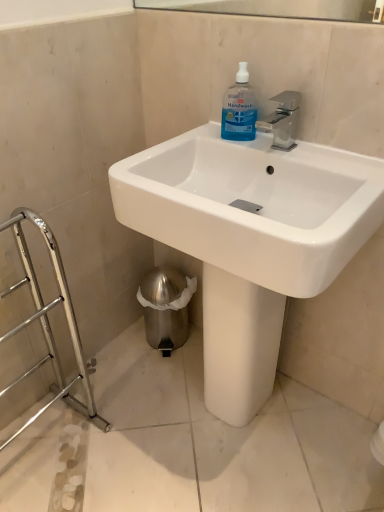
Question: Is transparent plastic handwash at upper center positioned before white glossy sink at center?

Choices:
 (A) yes
 (B) no

Answer: (B)

Question: Considering the relative sizes of transparent plastic handwash at upper center and white glossy sink at center in the image provided, is transparent plastic handwash at upper center smaller than white glossy sink at center?

Choices:
 (A) no
 (B) yes

Answer: (B)

Question: Is transparent plastic handwash at upper center to the left of white glossy sink at center from the viewer's perspective?

Choices:
 (A) yes
 (B) no

Answer: (A)

Question: Can you confirm if transparent plastic handwash at upper center is bigger than white glossy sink at center?

Choices:
 (A) no
 (B) yes

Answer: (A)

Question: Considering the relative sizes of transparent plastic handwash at upper center and white glossy sink at center in the image provided, is transparent plastic handwash at upper center wider than white glossy sink at center?

Choices:
 (A) no
 (B) yes

Answer: (A)

Question: From a real-world perspective, is transparent plastic handwash at upper center on white glossy sink at center?

Choices:
 (A) yes
 (B) no

Answer: (A)

Question: From the image's perspective, does white glossy sink at center appear higher than transparent plastic handwash at upper center?

Choices:
 (A) no
 (B) yes

Answer: (A)

Question: Can you confirm if white glossy sink at center is positioned to the left of transparent plastic handwash at upper center?

Choices:
 (A) yes
 (B) no

Answer: (B)

Question: Is transparent plastic handwash at upper center a part of white glossy sink at center?

Choices:
 (A) yes
 (B) no

Answer: (A)

Question: From a real-world perspective, is white glossy sink at center under transparent plastic handwash at upper center?

Choices:
 (A) yes
 (B) no

Answer: (A)

Question: Can you confirm if white glossy sink at center is smaller than transparent plastic handwash at upper center?

Choices:
 (A) yes
 (B) no

Answer: (B)

Question: Are white glossy sink at center and transparent plastic handwash at upper center located far from each other?

Choices:
 (A) no
 (B) yes

Answer: (A)

Question: Based on their sizes in the image, would you say white glossy sink at center is bigger or smaller than transparent plastic handwash at upper center?

Choices:
 (A) big
 (B) small

Answer: (A)